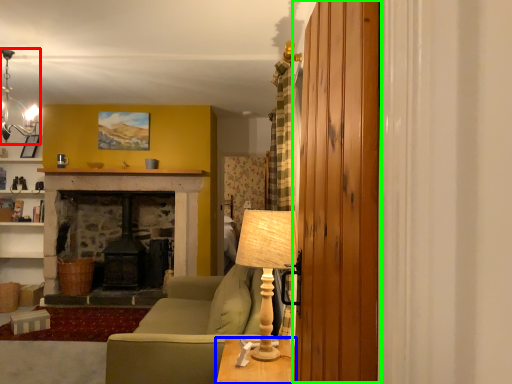
Question: Which object is the farthest from lamp (highlighted by a red box)? Choose among these: table (highlighted by a blue box) or barn door (highlighted by a green box).

Choices:
 (A) table
 (B) barn door

Answer: (B)